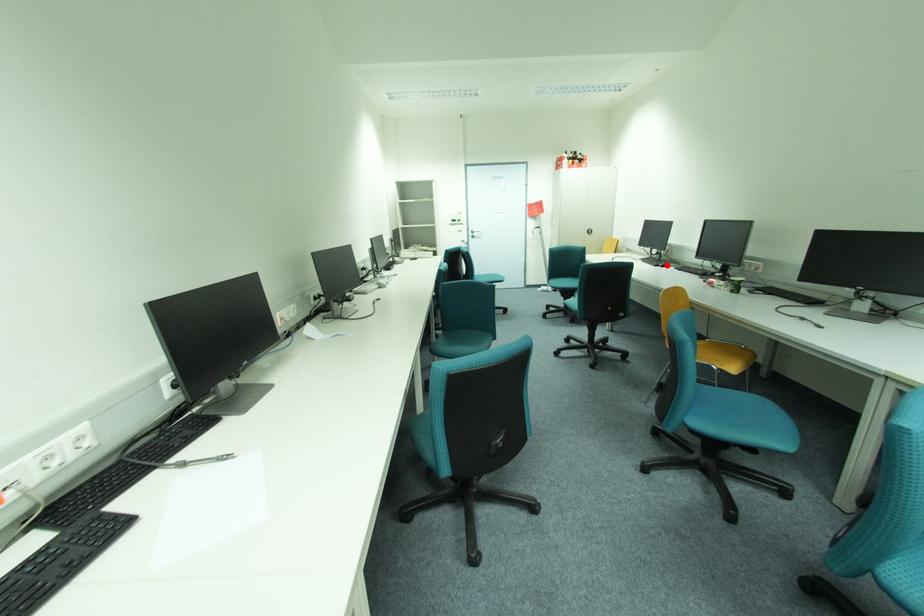
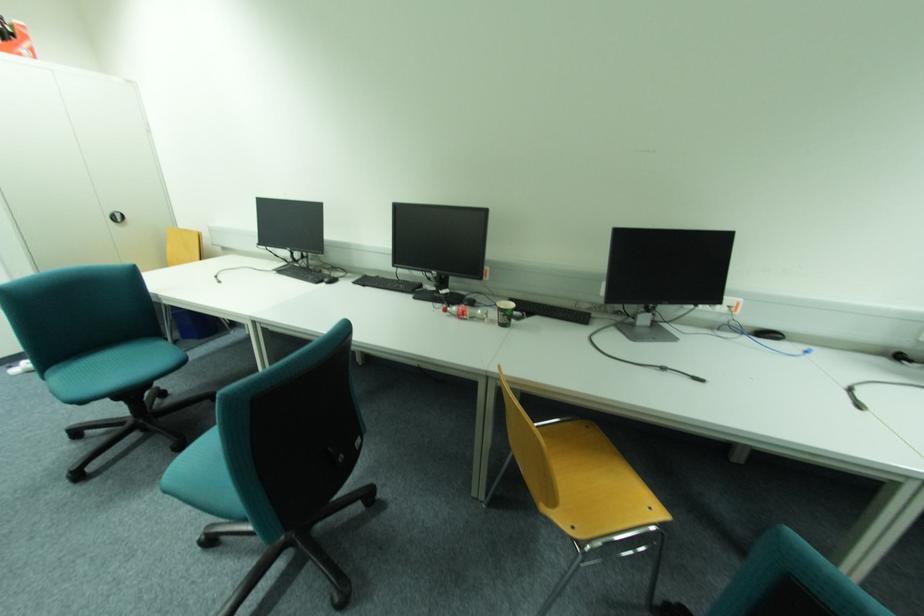
Question: I am providing you with two images of the same scene from different viewpoints. A red point is marked on the first image. At the location where the point appears in image 1, is it still visible in image 2?

Choices:
 (A) Yes
 (B) No

Answer: (A)